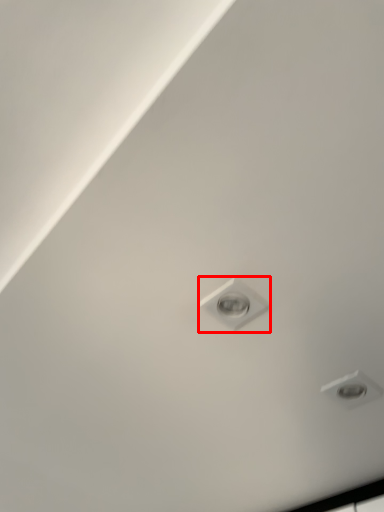
Question: Observing the image, what is the correct spatial positioning of light bulb (annotated by the red box) in reference to droplight?

Choices:
 (A) left
 (B) right

Answer: (A)